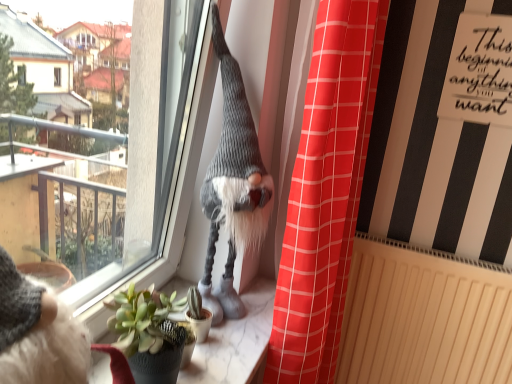
Question: Considering the relative sizes of beige textured radiator at lower right and marble at center in the image provided, is beige textured radiator at lower right taller than marble at center?

Choices:
 (A) yes
 (B) no

Answer: (A)

Question: From the image's perspective, is beige textured radiator at lower right above marble at center?

Choices:
 (A) yes
 (B) no

Answer: (B)

Question: Is beige textured radiator at lower right in contact with marble at center?

Choices:
 (A) no
 (B) yes

Answer: (A)

Question: Considering the relative positions of beige textured radiator at lower right and marble at center in the image provided, is beige textured radiator at lower right to the right of marble at center from the viewer's perspective?

Choices:
 (A) no
 (B) yes

Answer: (B)

Question: Can you confirm if beige textured radiator at lower right is wider than marble at center?

Choices:
 (A) yes
 (B) no

Answer: (B)

Question: In terms of size, does transparent glass window at upper center appear bigger or smaller than beige textured radiator at lower right?

Choices:
 (A) small
 (B) big

Answer: (B)

Question: From the image's perspective, relative to beige textured radiator at lower right, is transparent glass window at upper center above or below?

Choices:
 (A) below
 (B) above

Answer: (B)

Question: In terms of width, does transparent glass window at upper center look wider or thinner when compared to beige textured radiator at lower right?

Choices:
 (A) wide
 (B) thin

Answer: (A)

Question: Is transparent glass window at upper center situated inside beige textured radiator at lower right or outside?

Choices:
 (A) outside
 (B) inside

Answer: (A)

Question: Is transparent glass window at upper center spatially inside marble at center, or outside of it?

Choices:
 (A) inside
 (B) outside

Answer: (B)

Question: In terms of width, does transparent glass window at upper center look wider or thinner when compared to marble at center?

Choices:
 (A) thin
 (B) wide

Answer: (A)

Question: Looking at the image, does transparent glass window at upper center seem bigger or smaller compared to marble at center?

Choices:
 (A) small
 (B) big

Answer: (B)

Question: In terms of height, does transparent glass window at upper center look taller or shorter compared to marble at center?

Choices:
 (A) short
 (B) tall

Answer: (B)

Question: In terms of width, does knitted gray gnome at center look wider or thinner when compared to transparent glass window at upper center?

Choices:
 (A) thin
 (B) wide

Answer: (A)

Question: Would you say knitted gray gnome at center is inside or outside transparent glass window at upper center?

Choices:
 (A) inside
 (B) outside

Answer: (A)